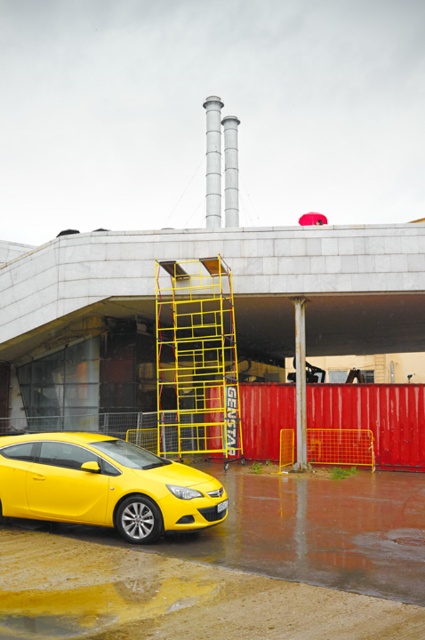
Can you confirm if shiny yellow car at lower left is bigger than yellow metal ladder at center?

No.

Which is in front, point (183, 474) or point (158, 435)?

Point (183, 474) is more forward.

Where is `shiny yellow car at lower left`? The height and width of the screenshot is (640, 425). shiny yellow car at lower left is located at coordinates (104, 484).